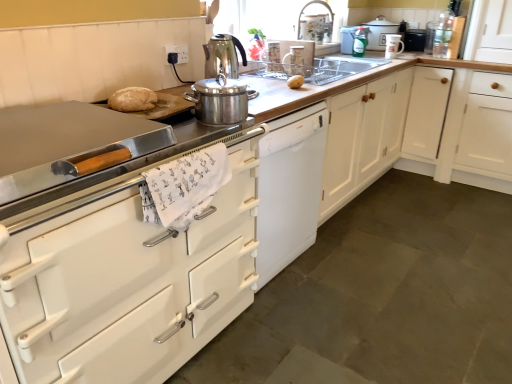
You are a GUI agent. You are given a task and a screenshot of the screen. Output one action in this format:
    pyautogui.click(x=<x>, y=<y>)
    Task: Click on the vacant space behind yellow matte potato at center
    The height and width of the screenshot is (384, 512).
    Given the screenshot: What is the action you would take?
    pyautogui.click(x=295, y=74)